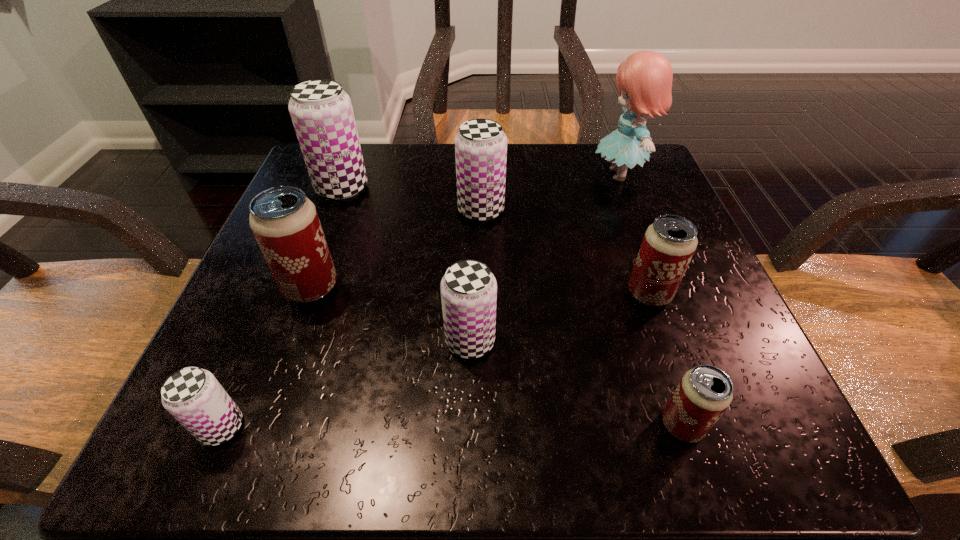
The image size is (960, 540). Identify the location of the nearest red beer can. (704, 393).

Image resolution: width=960 pixels, height=540 pixels. Find the location of `vacant space located on the front-facing side of the doll`. vacant space located on the front-facing side of the doll is located at coordinates (445, 174).

You are a GUI agent. You are given a task and a screenshot of the screen. Output one action in this format:
    pyautogui.click(x=<x>, y=<y>)
    Task: Click on the vacant space positioned 0.400m on the front-facing side of the doll
    The image size is (960, 540).
    Given the screenshot: What is the action you would take?
    pyautogui.click(x=397, y=174)

Where is `vacant area situated on the front-facing side of the doll`? Image resolution: width=960 pixels, height=540 pixels. vacant area situated on the front-facing side of the doll is located at coordinates (518, 174).

This screenshot has height=540, width=960. In order to click on free space located on the front of the tallest beer can in this screenshot , I will do `click(289, 329)`.

Locate an element on the screen. vacant area situated 0.330m on the front of the second biggest purple beer can is located at coordinates (481, 388).

At what (x,y) coordinates should I click in order to perform the action: click on vacant space situated on the back of the biggest red beer can. Please return your answer as a coordinate pair (x, y). Looking at the image, I should click on [354, 168].

I want to click on vacant region located on the left of the second smallest red beer can, so click(x=523, y=294).

Identify the location of free region located 0.110m on the right of the third nearest beer can. (573, 341).

What are the coordinates of `vacant space situated on the right of the smallest purple beer can` in the screenshot? It's located at (284, 427).